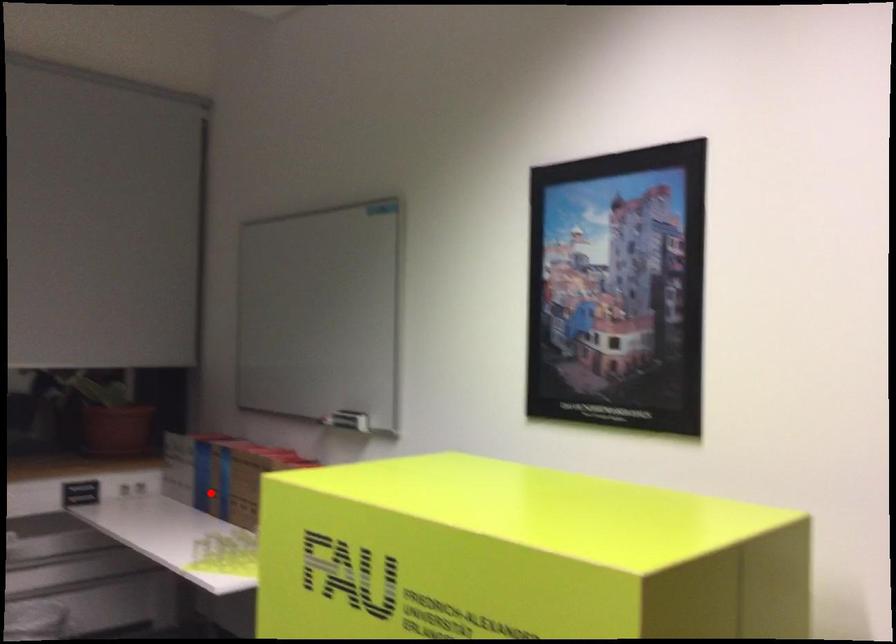
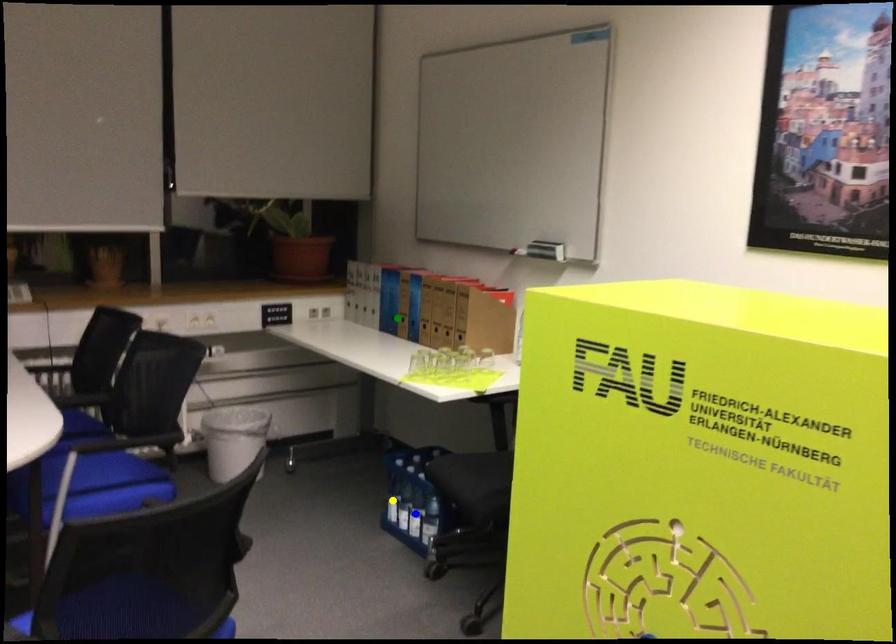
Question: I am providing you with two images of the same scene from different viewpoints. A red point is marked on the first image. You are given multiple points on the second image. Which point in image 2 represents the same 3d spot as the red point in image 1?

Choices:
 (A) yellow point
 (B) green point
 (C) blue point

Answer: (B)